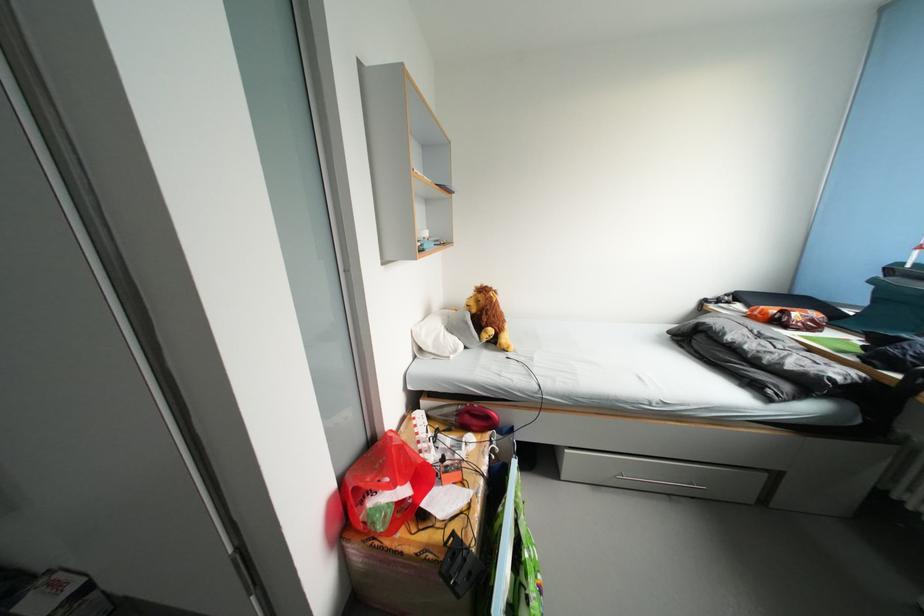
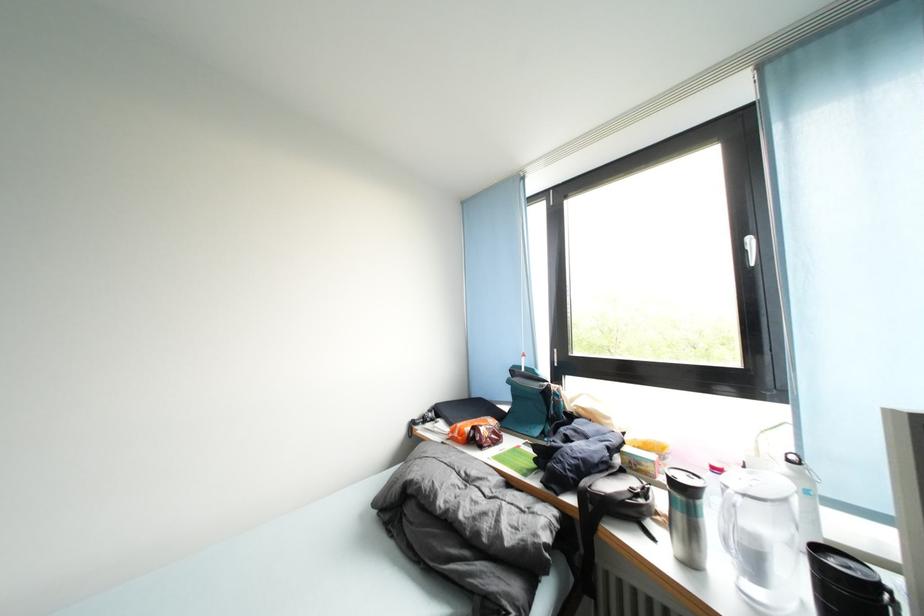
The point at (786,326) is marked in the first image. Where is the corresponding point in the second image?

(482, 446)